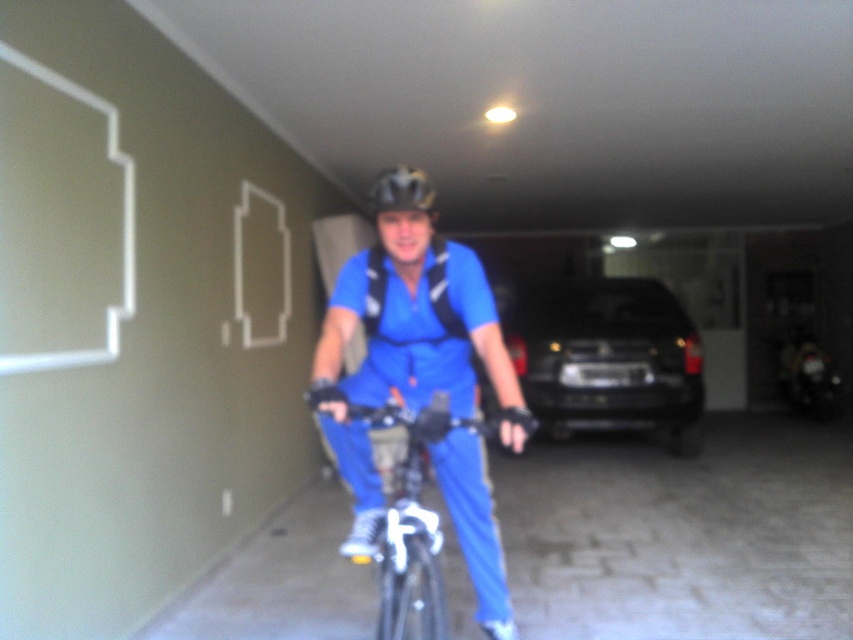
You are a delivery person who needs to park your black matte suv at center and your black matte helmet at center in a small garage. Based on their positions in the image, which object should you move first to fit both into the garage?

The black matte suv at center is to the right of black matte helmet at center. Since the SUV is larger, you should move the helmet first to make space for the SUV.

You are a delivery person who needs to quickly exit the garage. You see the black matte suv at center and the metallic silver bicycle at center. Which one is closer to the garage door?

The metallic silver bicycle at center is behind the black matte suv at center, so the black matte suv at center is closer to the garage door.

You are a delivery person who needs to maneuver your metallic silver bicycle at center through a narrow doorway. There is a black matte suv at center parked nearby. Considering their widths, which vehicle is wider and might block the doorway?

The black matte suv at center is wider than the metallic silver bicycle at center, so it might block the doorway.